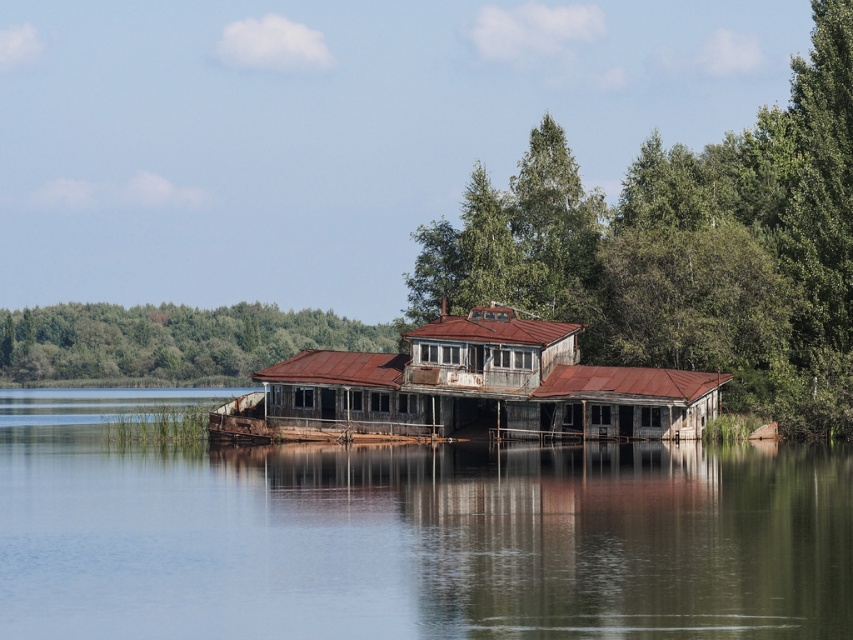
Is rusty metal building at center in front of green leafy trees at left?

That is True.

Measure the distance between point (720, 381) and camera.

Point (720, 381) is 73.28 meters away from camera.

What do you see at coordinates (469, 388) in the screenshot? I see `rusty metal building at center` at bounding box center [469, 388].

Where is `rusty metal building at center`? Image resolution: width=853 pixels, height=640 pixels. rusty metal building at center is located at coordinates (469, 388).

Which is behind, point (527, 358) or point (285, 419)?

Point (285, 419)

Can you confirm if rusty metal building at center is taller than rusty wood hut at center?

Yes.

Is point (508, 408) positioned before point (381, 394)?

Yes, point (508, 408) is in front of point (381, 394).

Image resolution: width=853 pixels, height=640 pixels. I want to click on rusty metal building at center, so click(469, 388).

Can you confirm if rusty metallic water at center is smaller than green leafy tree at upper center?

Yes.

Image resolution: width=853 pixels, height=640 pixels. Describe the element at coordinates (410, 534) in the screenshot. I see `rusty metallic water at center` at that location.

Is point (38, 436) positioned after point (548, 291)?

Yes, it is.

Locate an element on the screen. rusty metallic water at center is located at coordinates (410, 534).